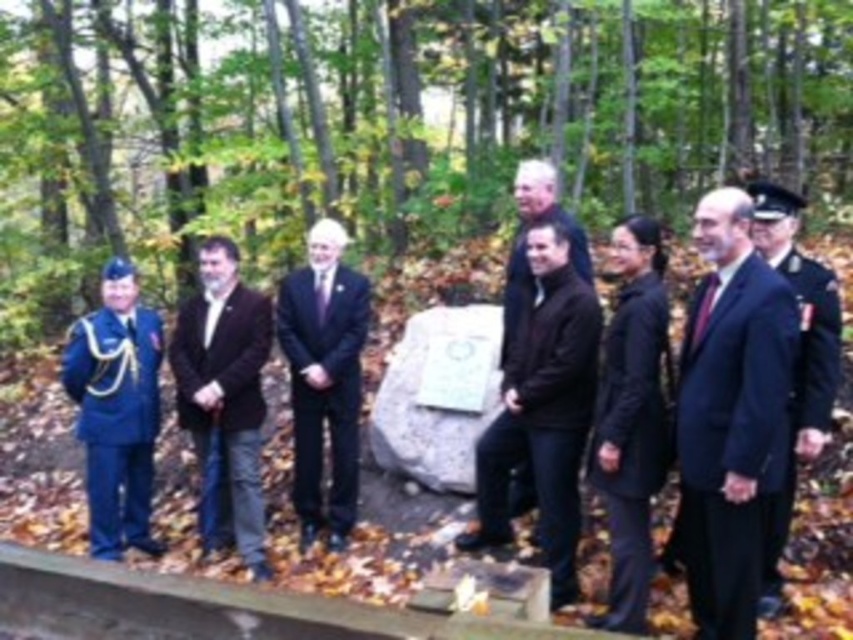
You are organizing a group photo and need to ensure everyone fits within the camera frame. The dark brown leather jacket at center and the black matte suit at center are both at the center. Which one has a larger width that could affect the framing?

The dark brown leather jacket at center might be wider than the black matte suit at center, so it could affect the framing more due to its potential larger width.

You are standing at the position of the dark brown leather jacket at center and want to take a photo of the monument plaque. The camera is 6.74 meters away from you. Is the camera within your reach? Please explain your reasoning.

The camera is 6.74 meters away from the dark brown leather jacket at center, so it is not within reach since the average person cannot reach 6.74 meters without assistance.